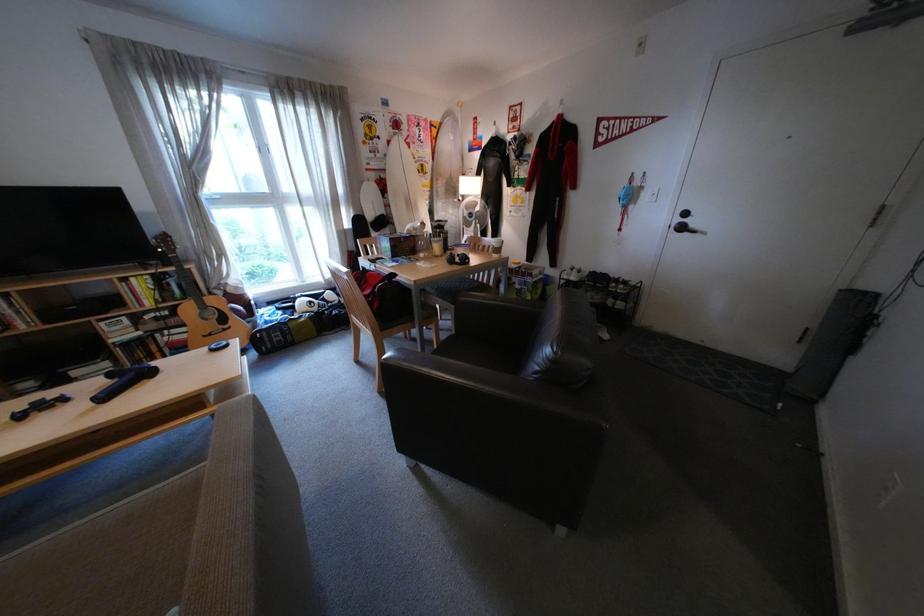
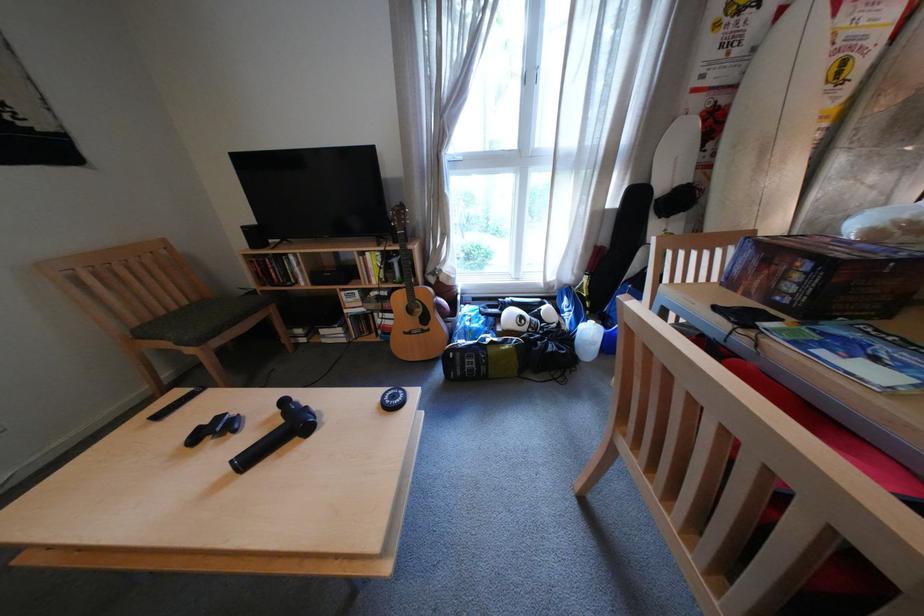
Where in the second image is the point corresponding to point (220, 334) from the first image?

(420, 331)